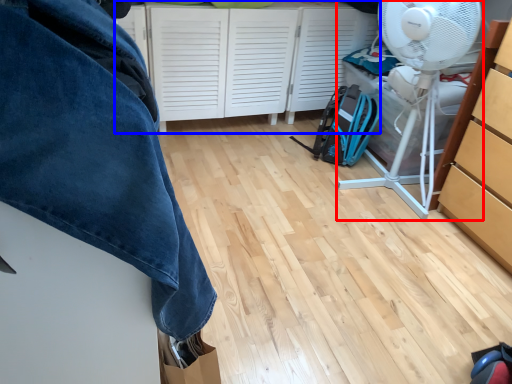
Question: Which point is further to the camera, mechanical fan (highlighted by a red box) or cabinetry (highlighted by a blue box)?

Choices:
 (A) mechanical fan
 (B) cabinetry

Answer: (B)